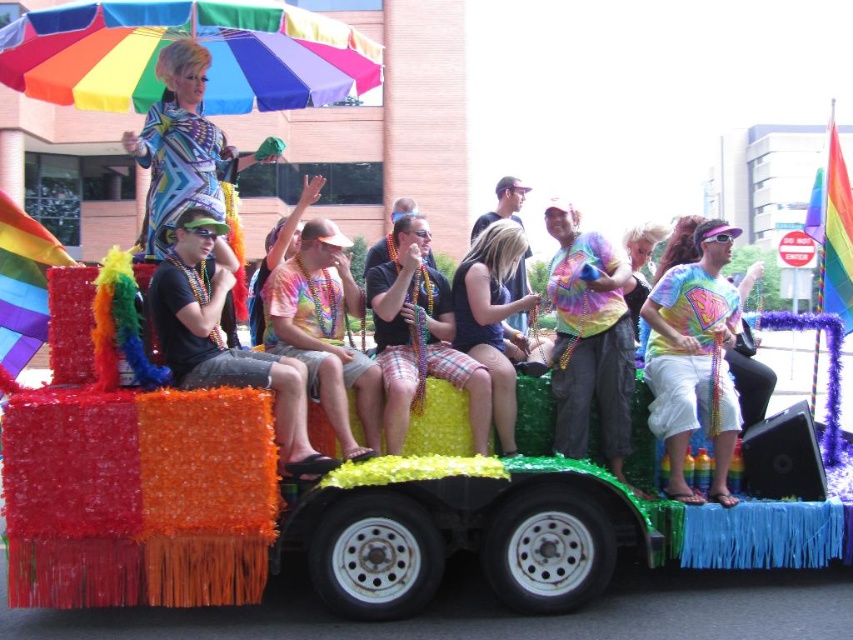
Consider the image. You are standing in front of the Pride parade float and want to take a photo. You notice two points on the float marked as point 1 at coordinates point (728,408) and point 2 at coordinates point (505,332). Which point is closer to your camera lens?

Point (728,408) is closer to the camera than point (505,332).

You are a photographer trying to capture a clear shot of the black fabric tank top at center. The rainbow fabric umbrella at upper left is in the way. Can you estimate if the umbrella is wider than the tank top?

The rainbow fabric umbrella at upper left might be wider than black fabric tank top at center, so there is a possibility that the umbrella could block the view of the tank top if it is indeed wider.